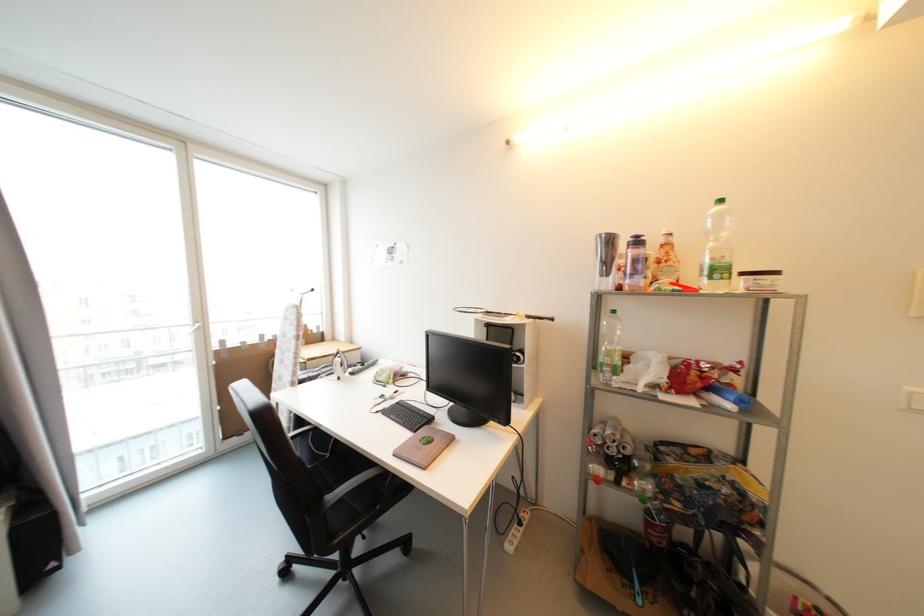
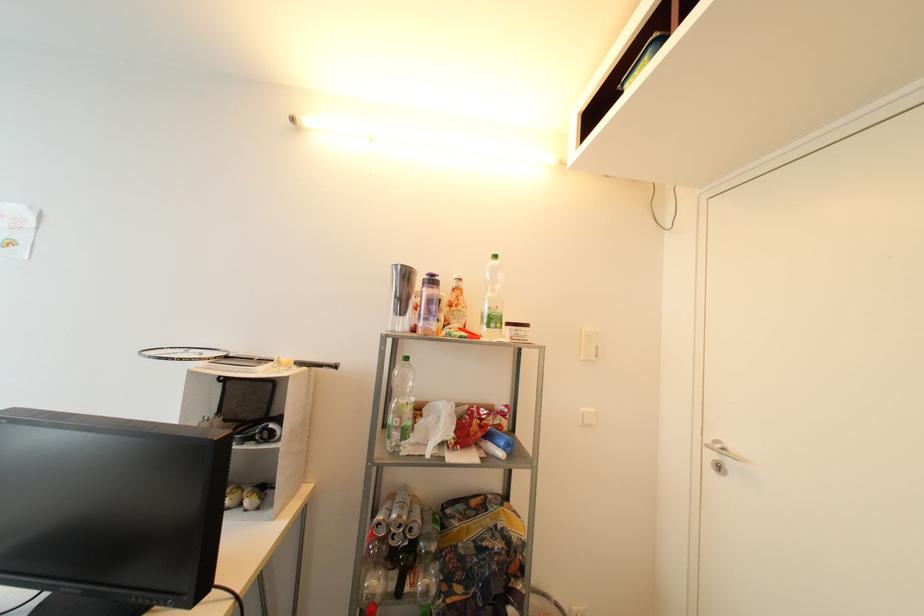
Question: I am providing you with two images of the same scene from different viewpoints. Which of the following objects are not visible in image2?

Choices:
 (A) aluminum can
 (B) white light switch
 (C) clear plastic bottle
 (D) none of these

Answer: (D)